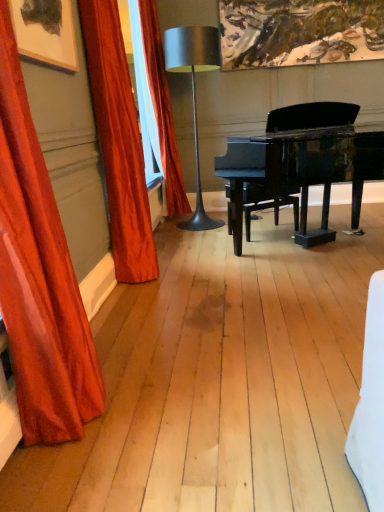
This screenshot has height=512, width=384. What do you see at coordinates (118, 142) in the screenshot? I see `satin red curtain at left, acting as the 2th curtain starting from the front` at bounding box center [118, 142].

Identify the location of satin red curtain at left, acting as the 1th curtain starting from the front. (39, 277).

What is the approximate height of satin red curtain at left, the third curtain from the back?

satin red curtain at left, the third curtain from the back, is 1.52 meters in height.

Where is `satin orange curtain at left, the 1th curtain viewed from the back`? This screenshot has width=384, height=512. satin orange curtain at left, the 1th curtain viewed from the back is located at coordinates (162, 109).

What is the approximate height of metallic silver table lamp at center?

metallic silver table lamp at center is 1.78 meters in height.

This screenshot has width=384, height=512. What do you see at coordinates (303, 170) in the screenshot?
I see `black polished piano at center` at bounding box center [303, 170].

Find the location of a particular element. black polished piano at center is located at coordinates (303, 170).

Find the location of a particular element. This screenshot has width=384, height=512. satin red curtain at left, acting as the 2th curtain starting from the front is located at coordinates (118, 142).

Which is behind, point (351, 169) or point (32, 395)?

The point (351, 169) is behind.

Does black polished piano at center have a larger size compared to satin red curtain at left, the third curtain from the back?

Yes.

From the image's perspective, which one is positioned lower, black polished piano at center or satin red curtain at left, the third curtain from the back?

From the image's view, satin red curtain at left, the third curtain from the back, is below.

Can you confirm if black polished piano at center is positioned to the right of satin red curtain at left, the third curtain from the back?

Indeed, black polished piano at center is positioned on the right side of satin red curtain at left, the third curtain from the back.

Would you say satin red curtain at left, arranged as the second curtain when viewed from the back, contains black polished piano at center?

Definitely not — black polished piano at center is not inside satin red curtain at left, arranged as the second curtain when viewed from the back.

Which of these two, satin red curtain at left, acting as the 2th curtain starting from the front, or black polished piano at center, is smaller?

Smaller between the two is satin red curtain at left, acting as the 2th curtain starting from the front.

Are satin red curtain at left, acting as the 2th curtain starting from the front, and black polished piano at center making contact?

No, satin red curtain at left, acting as the 2th curtain starting from the front, is not with black polished piano at center.

Considering the sizes of satin red curtain at left, acting as the 2th curtain starting from the front, and black polished piano at center in the image, is satin red curtain at left, acting as the 2th curtain starting from the front, wider or thinner than black polished piano at center?

Considering their sizes, satin red curtain at left, acting as the 2th curtain starting from the front, looks slimmer than black polished piano at center.

From the image's perspective, which curtain is the 2nd one below the metallic silver table lamp at center? Please provide its 2D coordinates.

[(39, 277)]

From the image's perspective, is metallic silver table lamp at center below satin red curtain at left, the third curtain from the back?

No, from the image's perspective, metallic silver table lamp at center is not beneath satin red curtain at left, the third curtain from the back.

Is metallic silver table lamp at center further to the viewer compared to satin red curtain at left, acting as the 1th curtain starting from the front?

Yes, metallic silver table lamp at center is further from the viewer.

Considering the positions of objects metallic silver table lamp at center and satin red curtain at left, acting as the 1th curtain starting from the front, in the image provided, who is more to the right, metallic silver table lamp at center or satin red curtain at left, acting as the 1th curtain starting from the front,?

From the viewer's perspective, metallic silver table lamp at center appears more on the right side.

Looking at this image, can you confirm if satin red curtain at left, the third curtain from the back, is positioned to the right of black polished piano at center?

In fact, satin red curtain at left, the third curtain from the back, is to the left of black polished piano at center.

In terms of height, does satin red curtain at left, the third curtain from the back, look taller or shorter compared to black polished piano at center?

In the image, satin red curtain at left, the third curtain from the back, appears to be taller than black polished piano at center.

From a real-world perspective, is satin red curtain at left, acting as the 1th curtain starting from the front, physically above black polished piano at center?

Yes.

In terms of width, does satin red curtain at left, acting as the 1th curtain starting from the front, look wider or thinner when compared to black polished piano at center?

In the image, satin red curtain at left, acting as the 1th curtain starting from the front, appears to be more narrow than black polished piano at center.

Are satin red curtain at left, arranged as the second curtain when viewed from the back, and satin orange curtain at left, placed as the 3th curtain when sorted from front to back, beside each other?

satin red curtain at left, arranged as the second curtain when viewed from the back, is not next to satin orange curtain at left, placed as the 3th curtain when sorted from front to back, and they're not touching.

From the picture: Which is correct: satin red curtain at left, acting as the 2th curtain starting from the front, is inside satin orange curtain at left, the 1th curtain viewed from the back, or outside of it?

satin red curtain at left, acting as the 2th curtain starting from the front, is located beyond the bounds of satin orange curtain at left, the 1th curtain viewed from the back.

From a real-world perspective, between satin red curtain at left, arranged as the second curtain when viewed from the back, and satin orange curtain at left, placed as the 3th curtain when sorted from front to back, who is vertically lower?

satin red curtain at left, arranged as the second curtain when viewed from the back, from a real-world perspective.

In the scene shown: From their relative heights in the image, would you say satin red curtain at left, arranged as the second curtain when viewed from the back, is taller or shorter than satin orange curtain at left, placed as the 3th curtain when sorted from front to back?

Considering their sizes, satin red curtain at left, arranged as the second curtain when viewed from the back, has less height than satin orange curtain at left, placed as the 3th curtain when sorted from front to back.

Is satin red curtain at left, acting as the 1th curtain starting from the front, not inside satin red curtain at left, acting as the 2th curtain starting from the front?

Absolutely, satin red curtain at left, acting as the 1th curtain starting from the front, is external to satin red curtain at left, acting as the 2th curtain starting from the front.

Can you confirm if satin red curtain at left, the third curtain from the back, is taller than satin red curtain at left, arranged as the second curtain when viewed from the back?

No.

From a real-world perspective, between satin red curtain at left, the third curtain from the back, and satin red curtain at left, arranged as the second curtain when viewed from the back, who is vertically lower?

satin red curtain at left, the third curtain from the back, is physically lower.

Is point (38, 326) behind point (127, 114)?

No, (38, 326) is closer to viewer.

Does black polished piano at center have a greater width compared to satin red curtain at left, arranged as the second curtain when viewed from the back?

Indeed, black polished piano at center has a greater width compared to satin red curtain at left, arranged as the second curtain when viewed from the back.

From a real-world perspective, who is located lower, black polished piano at center or satin red curtain at left, arranged as the second curtain when viewed from the back?

In real-world perspective, black polished piano at center is lower.

Looking at this image, is the surface of black polished piano at center in direct contact with satin red curtain at left, arranged as the second curtain when viewed from the back?

They are not placed beside each other.

The width and height of the screenshot is (384, 512). Find the location of `the 2nd curtain to the left of the black polished piano at center, starting your count from the anchor`. the 2nd curtain to the left of the black polished piano at center, starting your count from the anchor is located at coordinates (118, 142).

Where is `curtain lying in front of the black polished piano at center`? curtain lying in front of the black polished piano at center is located at coordinates (39, 277).

Where is `piano below the satin red curtain at left, acting as the 2th curtain starting from the front (from a real-world perspective)`? This screenshot has height=512, width=384. piano below the satin red curtain at left, acting as the 2th curtain starting from the front (from a real-world perspective) is located at coordinates (303, 170).

Based on their spatial positions, is black polished piano at center or satin red curtain at left, acting as the 1th curtain starting from the front, further from metallic silver table lamp at center?

The object further to metallic silver table lamp at center is satin red curtain at left, acting as the 1th curtain starting from the front.

Estimate the real-world distances between objects in this image. Which object is further from satin red curtain at left, acting as the 1th curtain starting from the front, metallic silver table lamp at center or black polished piano at center?

The object further to satin red curtain at left, acting as the 1th curtain starting from the front, is metallic silver table lamp at center.

Based on the photo, when comparing their distances from black polished piano at center, does satin red curtain at left, acting as the 2th curtain starting from the front, or metallic silver table lamp at center seem further?

metallic silver table lamp at center is further to black polished piano at center.

Looking at this image, estimate the real-world distances between objects in this image. Which object is further from satin red curtain at left, acting as the 2th curtain starting from the front, satin red curtain at left, the third curtain from the back, or black polished piano at center?

satin red curtain at left, the third curtain from the back, is positioned further to the anchor satin red curtain at left, acting as the 2th curtain starting from the front.

Based on their spatial positions, is satin red curtain at left, the third curtain from the back, or satin red curtain at left, acting as the 2th curtain starting from the front, further from metallic silver table lamp at center?

Among the two, satin red curtain at left, the third curtain from the back, is located further to metallic silver table lamp at center.

Looking at the image, which one is located further to metallic silver table lamp at center, satin red curtain at left, the third curtain from the back, or satin orange curtain at left, placed as the 3th curtain when sorted from front to back?

satin red curtain at left, the third curtain from the back.

Considering their positions, is satin orange curtain at left, the 1th curtain viewed from the back, positioned closer to satin red curtain at left, acting as the 2th curtain starting from the front, than metallic silver table lamp at center?

metallic silver table lamp at center is closer to satin red curtain at left, acting as the 2th curtain starting from the front.

Based on their spatial positions, is satin orange curtain at left, the 1th curtain viewed from the back, or satin red curtain at left, the third curtain from the back, closer to satin red curtain at left, acting as the 2th curtain starting from the front?

The object closer to satin red curtain at left, acting as the 2th curtain starting from the front, is satin red curtain at left, the third curtain from the back.

Where is `piano located between satin red curtain at left, acting as the 1th curtain starting from the front, and satin orange curtain at left, the 1th curtain viewed from the back, in the depth direction`? This screenshot has height=512, width=384. piano located between satin red curtain at left, acting as the 1th curtain starting from the front, and satin orange curtain at left, the 1th curtain viewed from the back, in the depth direction is located at coordinates 303,170.

At what (x,y) coordinates should I click in order to perform the action: click on curtain positioned between black polished piano at center and metallic silver table lamp at center from near to far. Please return your answer as a coordinate pair (x, y). The height and width of the screenshot is (512, 384). Looking at the image, I should click on (118, 142).

Where is `table lamp between black polished piano at center and satin orange curtain at left, placed as the 3th curtain when sorted from front to back, in the front-back direction`? The image size is (384, 512). table lamp between black polished piano at center and satin orange curtain at left, placed as the 3th curtain when sorted from front to back, in the front-back direction is located at coordinates (194, 93).

You are a GUI agent. You are given a task and a screenshot of the screen. Output one action in this format:
    pyautogui.click(x=<x>, y=<y>)
    Task: Click on the table lamp positioned between satin red curtain at left, acting as the 2th curtain starting from the front, and satin orange curtain at left, placed as the 3th curtain when sorted from front to back, from near to far
    
    Given the screenshot: What is the action you would take?
    coord(194,93)